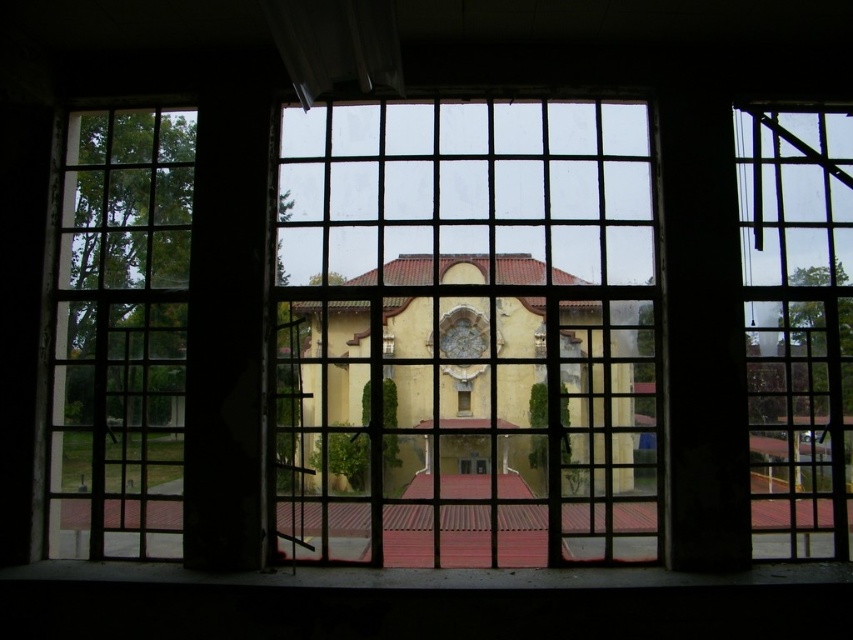
In the scene shown: Who is shorter, clear glass window at left or clear glass window at right?

Standing shorter between the two is clear glass window at right.

Can you confirm if clear glass window at left is positioned above clear glass window at right?

Incorrect, clear glass window at left is not positioned above clear glass window at right.

Does point (134, 252) come in front of point (805, 536)?

No.

The width and height of the screenshot is (853, 640). Find the location of `clear glass window at left`. clear glass window at left is located at coordinates (120, 336).

Measure the distance between clear glass window at left and camera.

clear glass window at left is 4.84 meters away from camera.

What do you see at coordinates (120, 336) in the screenshot? The image size is (853, 640). I see `clear glass window at left` at bounding box center [120, 336].

Is point (132, 134) more distant than point (575, 323)?

Yes, it is behind point (575, 323).

The image size is (853, 640). Find the location of `clear glass window at left`. clear glass window at left is located at coordinates [120, 336].

Is clear glass window at center bigger than clear glass window at right?

Correct, clear glass window at center is larger in size than clear glass window at right.

The image size is (853, 640). Describe the element at coordinates (467, 333) in the screenshot. I see `clear glass window at center` at that location.

Describe the element at coordinates (467, 333) in the screenshot. I see `clear glass window at center` at that location.

The width and height of the screenshot is (853, 640). I want to click on clear glass window at center, so click(467, 333).